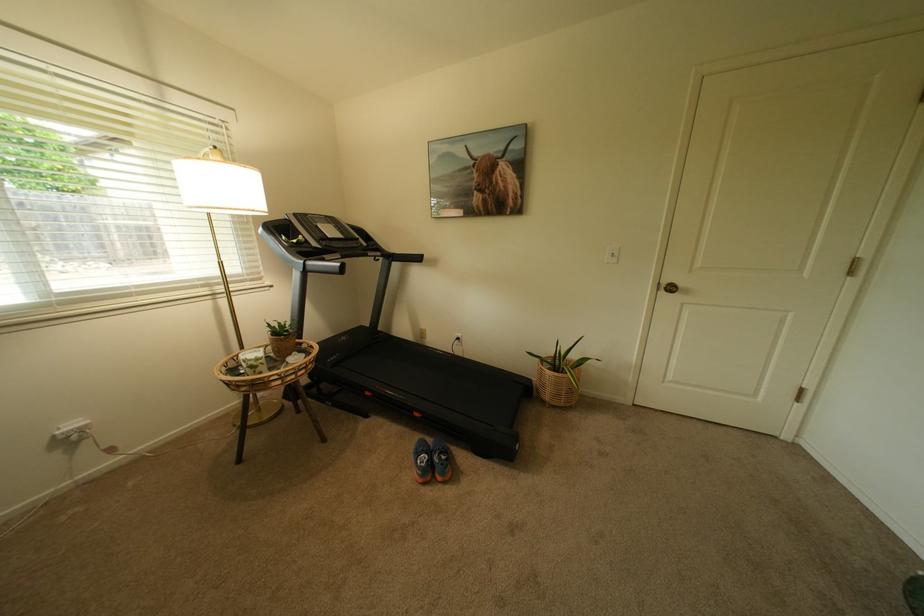
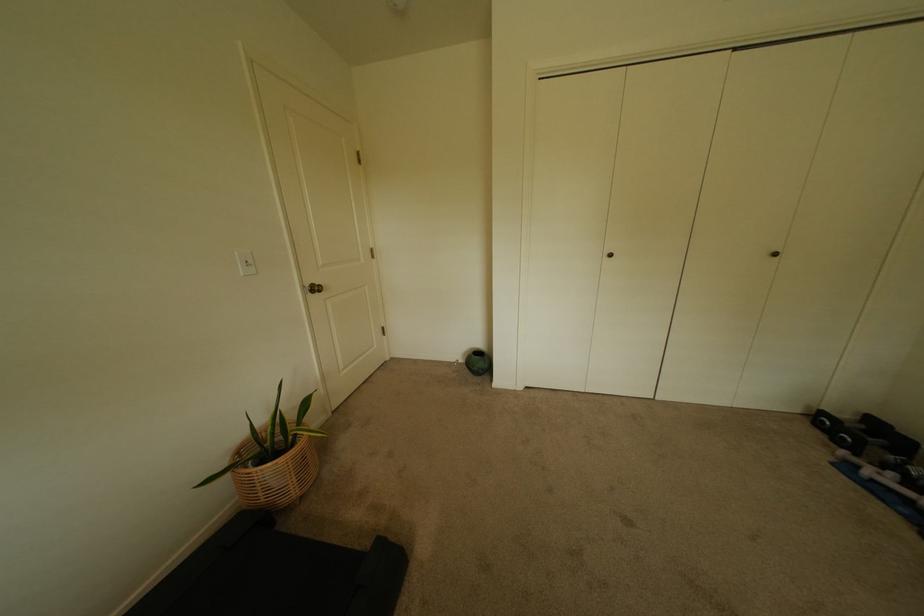
Locate, in the second image, the point that corresponds to (557,391) in the first image.

(302, 480)